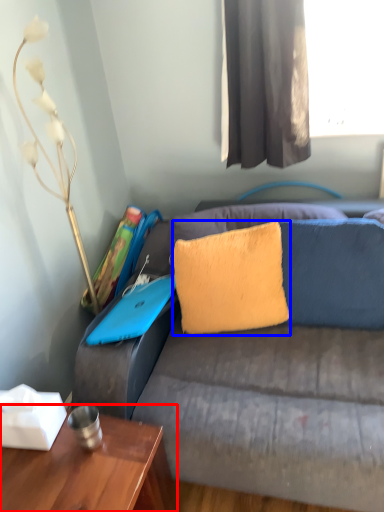
Question: Which of the following is the closest to the observer, table (highlighted by a red box) or pillow (highlighted by a blue box)?

Choices:
 (A) table
 (B) pillow

Answer: (A)